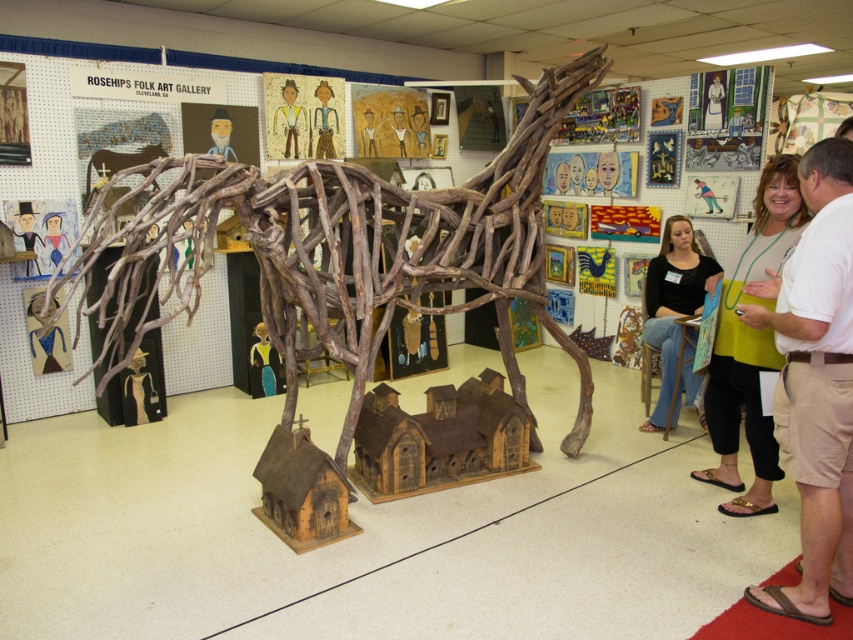
You are standing in the Rosehips Folk Art Gallery and want to get a closer look at the large rustic wooden horse sculpture. The gallery has a strict rule that visitors must stay at least 3 meters away from all displayed artworks. If you move forward to the point marked at coordinates (x=459, y=220), will you be violating the gallery rules?

The point at coordinates (x=459, y=220) is 3.46 meters away from the viewer. Since the minimum required distance is 3 meters, moving to this point would still keep you compliant with the gallery rules as 3.46 meters is greater than 3 meters.

You are an art curator planning to install a new display case for the brown cargo shorts at right next to the brown driftwood horse at center. Since the display case must be placed at the same height as the cargo shorts, will the display case fit under the horse sculpture without being blocked?

The brown driftwood horse at center is taller than the brown cargo shorts at right, so the display case placed at the same height as the cargo shorts will fit under the horse sculpture without being blocked.